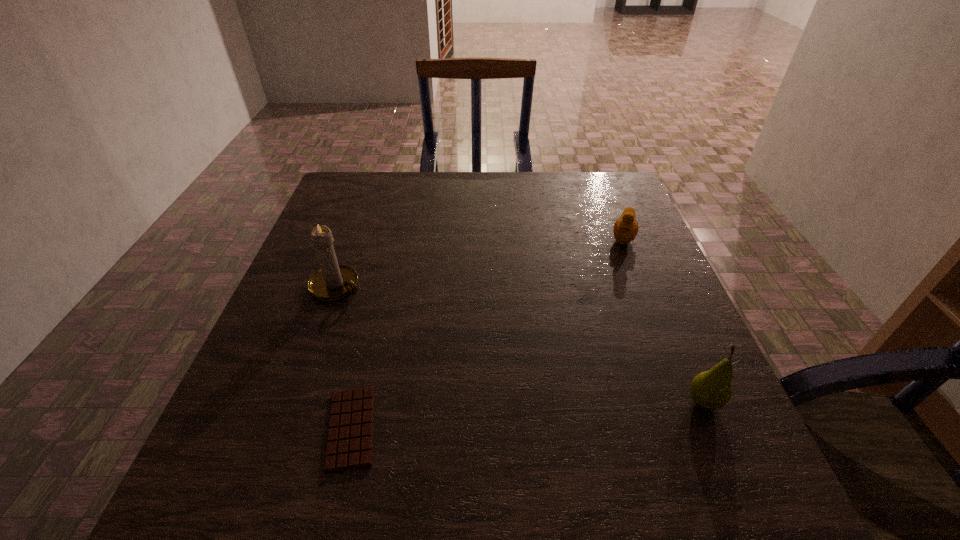
Where is `object that is at the near right corner`? Image resolution: width=960 pixels, height=540 pixels. object that is at the near right corner is located at coordinates (711, 390).

In the image, there is a desktop. At what (x,y) coordinates should I click in order to perform the action: click on vacant space at the far edge. Please return your answer as a coordinate pair (x, y). The width and height of the screenshot is (960, 540). Looking at the image, I should click on (569, 183).

Find the location of a particular element. Image resolution: width=960 pixels, height=540 pixels. vacant space at the left edge of the desktop is located at coordinates (374, 226).

Identify the location of free region at the right edge of the desktop. (654, 253).

Image resolution: width=960 pixels, height=540 pixels. I want to click on vacant space at the far right corner of the desktop, so click(x=611, y=206).

Where is `vacant position at the near right corner of the desktop`? The image size is (960, 540). vacant position at the near right corner of the desktop is located at coordinates (721, 447).

Where is `vacant point located between the leftmost object and the farthest object`? Image resolution: width=960 pixels, height=540 pixels. vacant point located between the leftmost object and the farthest object is located at coordinates (480, 261).

Identify the location of free space between the third shortest object and the shortest object. (527, 415).

Find the location of `blank region between the second tallest object and the duckling`. blank region between the second tallest object and the duckling is located at coordinates (663, 319).

Find the location of `vacant point located between the candy bar and the third shortest object`. vacant point located between the candy bar and the third shortest object is located at coordinates (527, 415).